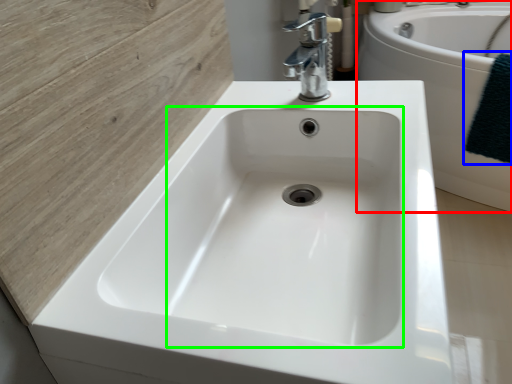
Question: Which is farther away from bath (highlighted by a red box)? bath towel (highlighted by a blue box) or sink (highlighted by a green box)?

Choices:
 (A) bath towel
 (B) sink

Answer: (B)